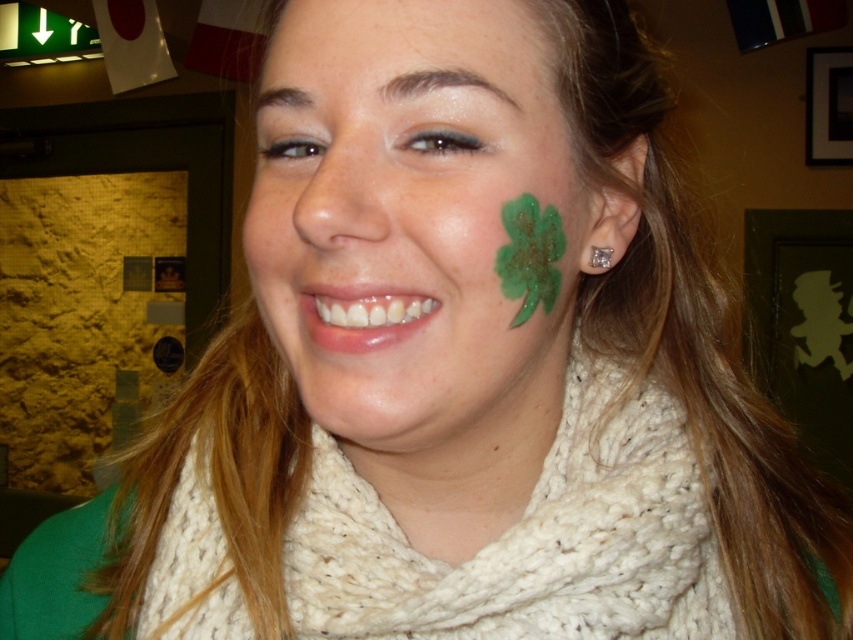
You are a photographer adjusting the camera focus. You want to ensure both the white knitted scarf at center and the clear crystal earring at ear are in focus. Since the scarf is wider, will you need to adjust the focus differently for the earring compared to the scarf?

The white knitted scarf at center is wider than the clear crystal earring at ear. To keep both in focus, you should focus on the scarf first as it covers more area, then slightly adjust the focus towards the earring due to its smaller size.

You are a photographer adjusting the lighting to highlight both the white knitted scarf at center and the clear crystal earring at ear. Based on their positions, which object should you focus on first to ensure proper lighting?

The white knitted scarf at center is in front of the clear crystal earring at ear, so you should focus on lighting the white knitted scarf at center first to ensure the earring behind it is also adequately lit.

You are a photographer adjusting your camera settings. You notice the green glittery shamrock at right and the clear crystal earring at ear in your frame. Which object appears closer to you in the photo?

The green glittery shamrock at right appears closer to the viewer than the clear crystal earring at ear.